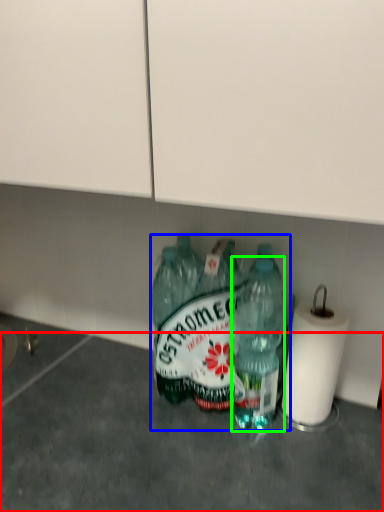
Question: Based on their relative distances, which object is nearer to concrete (highlighted by a red box)? Choose from bottle (highlighted by a blue box) and bottle (highlighted by a green box).

Choices:
 (A) bottle
 (B) bottle

Answer: (A)